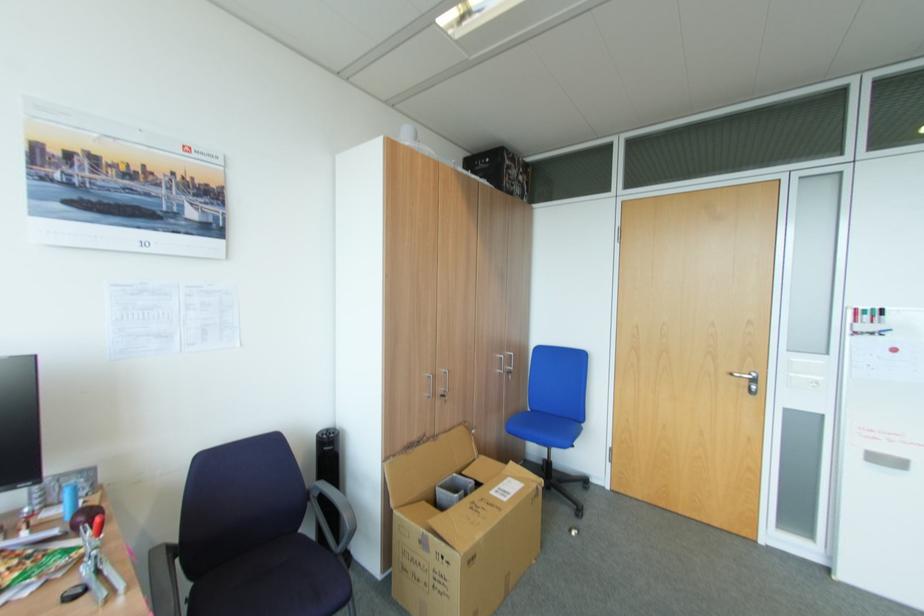
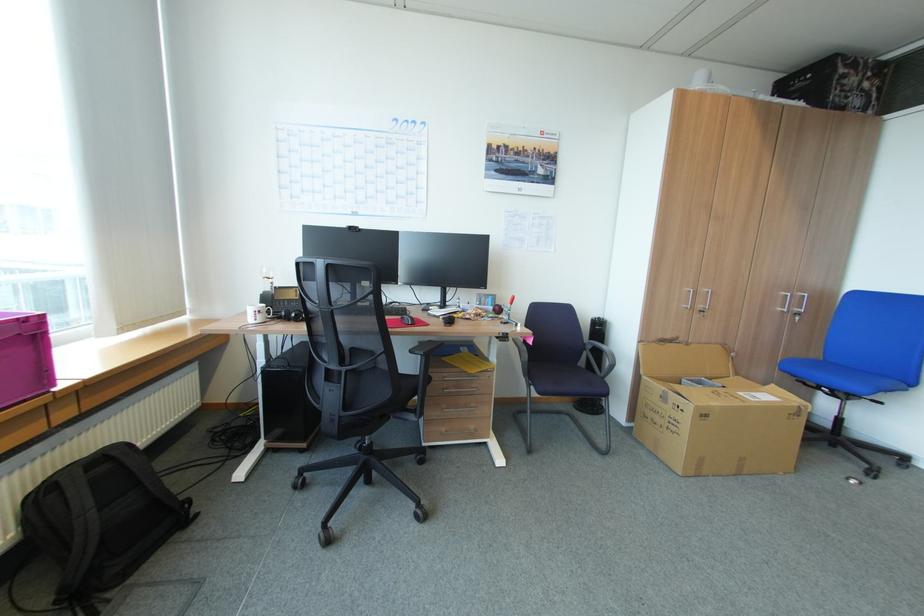
Where in the second image is the point corresponding to (x=504, y=370) from the first image?

(785, 309)